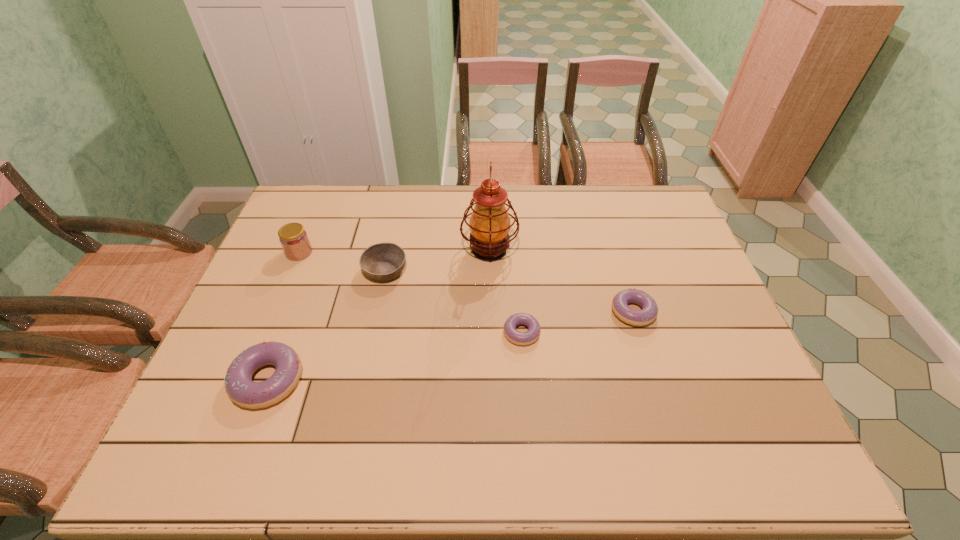
This screenshot has height=540, width=960. What are the coordinates of `vacant space that's between the rightmost object and the shortest object` in the screenshot? It's located at (577, 322).

This screenshot has width=960, height=540. In order to click on vacant point located between the fourth object from right to left and the second doughnut from right to left in this screenshot , I will do click(453, 302).

I want to click on unoccupied position between the fourth object from right to left and the shortest doughnut, so click(x=453, y=302).

Identify which object is the third nearest to the fourth object from right to left. Please provide its 2D coordinates. Your answer should be formatted as a tuple, i.e. [(x, y)], where the tuple contains the x and y coordinates of a point satisfying the conditions above.

[(240, 388)]

Choose which object is the second nearest neighbor to the tallest object. Please provide its 2D coordinates. Your answer should be formatted as a tuple, i.e. [(x, y)], where the tuple contains the x and y coordinates of a point satisfying the conditions above.

[(519, 338)]

What are the coordinates of `the second closest doughnut to the third object from left to right` in the screenshot? It's located at (519, 338).

Select which doughnut is the closest to the oil lamp. Please provide its 2D coordinates. Your answer should be formatted as a tuple, i.e. [(x, y)], where the tuple contains the x and y coordinates of a point satisfying the conditions above.

[(519, 338)]

Locate an element on the screen. This screenshot has height=540, width=960. vacant point that satisfies the following two spatial constraints: 1. on the front side of the second tallest object; 2. on the left side of the bowl is located at coordinates (292, 271).